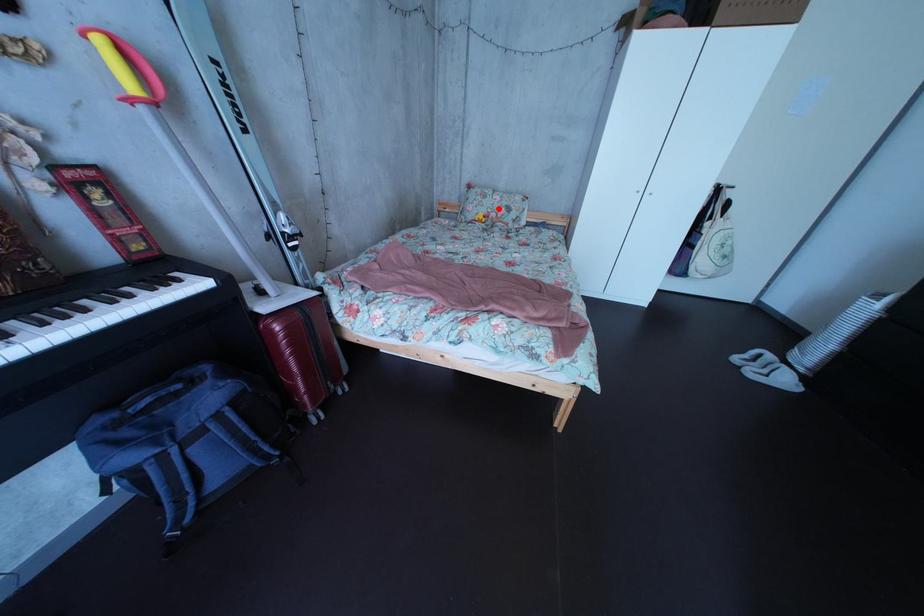
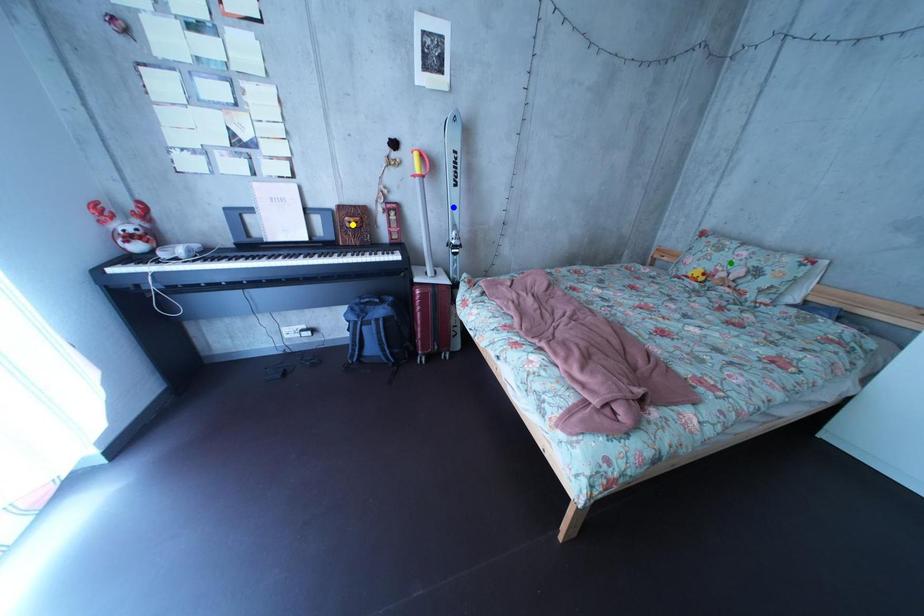
Question: I am providing you with two images of the same scene from different viewpoints. A red point is marked on the first image. You are given multiple points on the second image. Which point in image 2 represents the same 3d spot as the red point in image 1?

Choices:
 (A) yellow point
 (B) blue point
 (C) green point

Answer: (C)